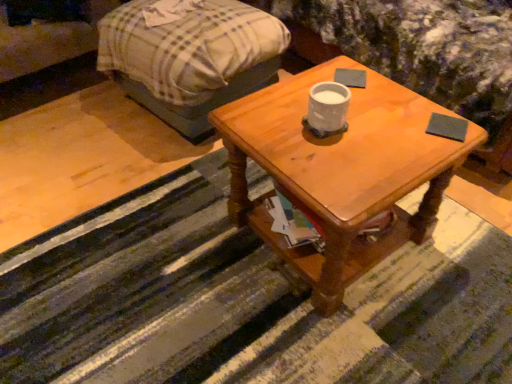
Question: Should I look upward or downward to see plaid fabric couch at upper left?

Choices:
 (A) up
 (B) down

Answer: (A)

Question: From the image's perspective, is plaid fabric couch at upper left on top of plaid fabric bed at upper left?

Choices:
 (A) no
 (B) yes

Answer: (B)

Question: Is plaid fabric couch at upper left positioned beyond the bounds of plaid fabric bed at upper left?

Choices:
 (A) yes
 (B) no

Answer: (A)

Question: Does plaid fabric couch at upper left have a smaller size compared to plaid fabric bed at upper left?

Choices:
 (A) no
 (B) yes

Answer: (B)

Question: Does plaid fabric couch at upper left come in front of plaid fabric bed at upper left?

Choices:
 (A) yes
 (B) no

Answer: (B)

Question: From the image's perspective, is plaid fabric couch at upper left located beneath plaid fabric bed at upper left?

Choices:
 (A) yes
 (B) no

Answer: (B)

Question: From a real-world perspective, is plaid fabric couch at upper left located higher than plaid fabric bed at upper left?

Choices:
 (A) yes
 (B) no

Answer: (A)

Question: Is dark gray matte pad at upper right, the 2th pad when ordered from back to front, bigger than dark gray matte pad at upper center, which appears as the 1th pad when viewed from the top?

Choices:
 (A) yes
 (B) no

Answer: (B)

Question: From a real-world perspective, does dark gray matte pad at upper right, the first pad when ordered from right to left, sit lower than dark gray matte pad at upper center, placed as the 1th pad when sorted from back to front?

Choices:
 (A) no
 (B) yes

Answer: (B)

Question: Does dark gray matte pad at upper right, the 1th pad when ordered from front to back, appear on the left side of dark gray matte pad at upper center, marked as the second pad in a right-to-left arrangement?

Choices:
 (A) no
 (B) yes

Answer: (A)

Question: From a real-world perspective, is dark gray matte pad at upper right, the second pad in the left-to-right sequence, physically above dark gray matte pad at upper center, which is counted as the 2th pad, starting from the front?

Choices:
 (A) yes
 (B) no

Answer: (B)

Question: Is dark gray matte pad at upper right, the 2th pad when ordered from back to front, taller than dark gray matte pad at upper center, which is counted as the 2th pad, starting from the front?

Choices:
 (A) no
 (B) yes

Answer: (A)

Question: Can you confirm if dark gray matte pad at upper right, the second pad in the left-to-right sequence, is thinner than dark gray matte pad at upper center, the first pad in the left-to-right sequence?

Choices:
 (A) no
 (B) yes

Answer: (B)

Question: Does dark gray matte pad at upper right, acting as the first pad starting from the bottom, have a lesser width compared to wooden coffee table at center?

Choices:
 (A) yes
 (B) no

Answer: (A)